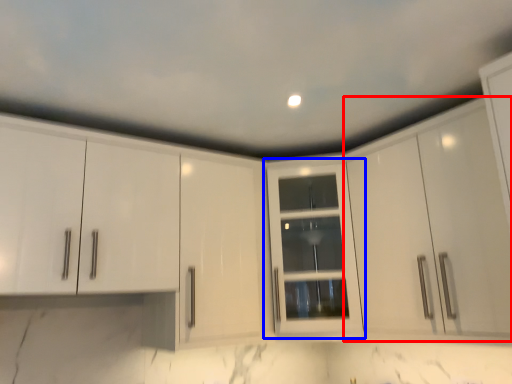
Question: Which point is closer to the camera, cabinetry (highlighted by a red box) or cabinetry (highlighted by a blue box)?

Choices:
 (A) cabinetry
 (B) cabinetry

Answer: (A)